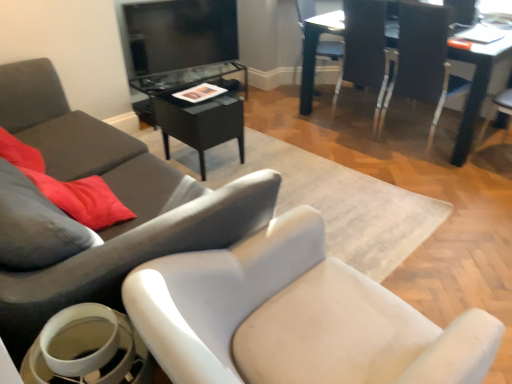
Describe the element at coordinates (84, 348) in the screenshot. I see `white glossy cup at lower left` at that location.

The height and width of the screenshot is (384, 512). Find the location of `matte gray chair at center, the 5th chair positioned from the right`. matte gray chair at center, the 5th chair positioned from the right is located at coordinates (106, 228).

What do you see at coordinates (295, 317) in the screenshot? I see `light gray fabric chair at lower left, the 2th chair positioned from the left` at bounding box center [295, 317].

Where is `matte black tv stand at upper center`? The height and width of the screenshot is (384, 512). matte black tv stand at upper center is located at coordinates (178, 46).

I want to click on wooden table at upper right, positioned as the first table in right-to-left order, so click(x=476, y=87).

Which object is closer to the camera taking this photo, white plastic chair at upper right, marked as the 5th chair in a left-to-right arrangement, or white plastic chair at upper right, the 3th chair from the left?

white plastic chair at upper right, marked as the 5th chair in a left-to-right arrangement, is in front.

From a real-world perspective, is white plastic chair at upper right, marked as the 1th chair in a right-to-left arrangement, over white plastic chair at upper right, the 3th chair from the left?

Yes, from a real-world perspective, white plastic chair at upper right, marked as the 1th chair in a right-to-left arrangement, is over white plastic chair at upper right, the 3th chair from the left

Between white plastic chair at upper right, marked as the 5th chair in a left-to-right arrangement, and white plastic chair at upper right, the 3th chair from the left, which one appears on the left side from the viewer's perspective?

Positioned to the left is white plastic chair at upper right, the 3th chair from the left.

Can you confirm if white plastic chair at upper right, marked as the 1th chair in a right-to-left arrangement, is taller than white plastic chair at upper right, the 3th chair when ordered from right to left?

Yes, white plastic chair at upper right, marked as the 1th chair in a right-to-left arrangement, is taller than white plastic chair at upper right, the 3th chair when ordered from right to left.

Locate an element on the screen. The image size is (512, 384). entertainment center that appears on the left of white glossy chair at upper right, marked as the 2th chair in a right-to-left arrangement is located at coordinates (178, 46).

Which object is thinner, matte black tv stand at upper center or white glossy chair at upper right, marked as the 2th chair in a right-to-left arrangement?

matte black tv stand at upper center.

Does matte black tv stand at upper center lie in front of white glossy chair at upper right, the fourth chair viewed from the left?

No, it is behind white glossy chair at upper right, the fourth chair viewed from the left.

Is white plastic chair at upper right, the 3th chair from the left, facing away from white glossy cup at lower left?

No.

Consider the image. Is white plastic chair at upper right, the 3th chair when ordered from right to left, wider than white glossy cup at lower left?

Yes.

From the image's perspective, is white plastic chair at upper right, the 3th chair when ordered from right to left, beneath white glossy cup at lower left?

No, from the image's perspective, white plastic chair at upper right, the 3th chair when ordered from right to left, is not below white glossy cup at lower left.

Consider the image. Which object is positioned more to the left, white plastic chair at upper right, the 3th chair when ordered from right to left, or white glossy cup at lower left?

Positioned to the left is white glossy cup at lower left.

In the scene shown: What's the angular difference between white glossy cup at lower left and white plastic chair at upper right, the 3th chair when ordered from right to left,'s facing directions?

There is a 77.1-degree angle between the facing directions of white glossy cup at lower left and white plastic chair at upper right, the 3th chair when ordered from right to left.

From a real-world perspective, count 1st chairs downward from the white glossy cup at lower left and point to it. Please provide its 2D coordinates.

[(331, 50)]

Does white glossy cup at lower left lie in front of white plastic chair at upper right, the 3th chair from the left?

Yes, white glossy cup at lower left is in front of white plastic chair at upper right, the 3th chair from the left.

From the image's perspective, between white glossy cup at lower left and white plastic chair at upper right, the 3th chair from the left, who is located below?

white glossy cup at lower left appears lower in the image.

Considering the positions of objects matte black tv stand at upper center and white plastic chair at upper right, marked as the 5th chair in a left-to-right arrangement, in the image provided, who is more to the right, matte black tv stand at upper center or white plastic chair at upper right, marked as the 5th chair in a left-to-right arrangement,?

white plastic chair at upper right, marked as the 5th chair in a left-to-right arrangement, is more to the right.

Who is smaller, matte black tv stand at upper center or white plastic chair at upper right, marked as the 5th chair in a left-to-right arrangement?

Smaller between the two is matte black tv stand at upper center.

From the image's perspective, which is above, matte black tv stand at upper center or white plastic chair at upper right, marked as the 5th chair in a left-to-right arrangement?

matte black tv stand at upper center.

Is white plastic chair at upper right, marked as the 5th chair in a left-to-right arrangement, completely or partially inside matte black tv stand at upper center?

No, white plastic chair at upper right, marked as the 5th chair in a left-to-right arrangement, is not inside matte black tv stand at upper center.

Is matte gray chair at center, the first chair when ordered from left to right, completely or partially outside of white plastic chair at upper right, marked as the 5th chair in a left-to-right arrangement?

Yes.

From the image's perspective, is matte gray chair at center, the first chair when ordered from left to right, above or below white plastic chair at upper right, marked as the 1th chair in a right-to-left arrangement?

matte gray chair at center, the first chair when ordered from left to right, is situated lower than white plastic chair at upper right, marked as the 1th chair in a right-to-left arrangement, in the image.

Does matte gray chair at center, the 5th chair positioned from the right, have a lesser width compared to white plastic chair at upper right, marked as the 1th chair in a right-to-left arrangement?

No, matte gray chair at center, the 5th chair positioned from the right, is not thinner than white plastic chair at upper right, marked as the 1th chair in a right-to-left arrangement.

From a real-world perspective, between matte gray chair at center, the first chair when ordered from left to right, and white plastic chair at upper right, marked as the 5th chair in a left-to-right arrangement, who is vertically higher?

white plastic chair at upper right, marked as the 5th chair in a left-to-right arrangement, is physically above.

From a real-world perspective, is white glossy cup at lower left positioned over white plastic chair at upper right, marked as the 5th chair in a left-to-right arrangement, based on gravity?

Actually, white glossy cup at lower left is physically below white plastic chair at upper right, marked as the 5th chair in a left-to-right arrangement, in the real world.

Looking at the image, does white glossy cup at lower left seem bigger or smaller compared to white plastic chair at upper right, marked as the 1th chair in a right-to-left arrangement?

Considering their sizes, white glossy cup at lower left takes up less space than white plastic chair at upper right, marked as the 1th chair in a right-to-left arrangement.

In the image, is white glossy cup at lower left positioned in front of or behind white plastic chair at upper right, marked as the 5th chair in a left-to-right arrangement?

Visually, white glossy cup at lower left is located in front of white plastic chair at upper right, marked as the 5th chair in a left-to-right arrangement.

How different are the orientations of white glossy cup at lower left and white plastic chair at upper right, marked as the 1th chair in a right-to-left arrangement, in degrees?

1.54 degrees separate the facing orientations of white glossy cup at lower left and white plastic chair at upper right, marked as the 1th chair in a right-to-left arrangement.

Where is `the 2nd chair counting from the right of the white plastic chair at upper right, the 3th chair when ordered from right to left`? the 2nd chair counting from the right of the white plastic chair at upper right, the 3th chair when ordered from right to left is located at coordinates pyautogui.click(x=423, y=57).

Identify the location of entertainment center that appears behind the white glossy chair at upper right, the fourth chair viewed from the left. (178, 46).

Estimate the real-world distances between objects in this image. Which object is closer to matte gray chair at center, the first chair when ordered from left to right, white glossy chair at upper right, marked as the 2th chair in a right-to-left arrangement, or white glossy cup at lower left?

white glossy cup at lower left lies closer to matte gray chair at center, the first chair when ordered from left to right, than the other object.

Estimate the real-world distances between objects in this image. Which object is closer to white glossy cup at lower left, white plastic chair at upper right, marked as the 5th chair in a left-to-right arrangement, or wooden table at upper right, positioned as the first table in right-to-left order?

Among the two, white plastic chair at upper right, marked as the 5th chair in a left-to-right arrangement, is located nearer to white glossy cup at lower left.

Which object lies nearer to the anchor point wooden table at upper right, positioned as the first table in right-to-left order, matte gray chair at center, the first chair when ordered from left to right, or matte black tv stand at upper center?

The object closer to wooden table at upper right, positioned as the first table in right-to-left order, is matte black tv stand at upper center.

Considering their positions, is wooden table at upper right, positioned as the first table in right-to-left order, positioned further to white plastic chair at upper right, the 3th chair when ordered from right to left, than white glossy cup at lower left?

white glossy cup at lower left is positioned further to the anchor white plastic chair at upper right, the 3th chair when ordered from right to left.

Estimate the real-world distances between objects in this image. Which object is closer to matte gray chair at center, the 5th chair positioned from the right, white plastic chair at upper right, the 3th chair from the left, or black glass table at center, acting as the 2th table starting from the right?

Among the two, black glass table at center, acting as the 2th table starting from the right, is located nearer to matte gray chair at center, the 5th chair positioned from the right.

Looking at the image, which one is located further to light gray fabric chair at lower left, which is counted as the fourth chair, starting from the right, matte gray chair at center, the 5th chair positioned from the right, or black glass table at center, acting as the 2th table starting from the right?

Among the two, black glass table at center, acting as the 2th table starting from the right, is located further to light gray fabric chair at lower left, which is counted as the fourth chair, starting from the right.

Estimate the real-world distances between objects in this image. Which object is closer to white plastic chair at upper right, the 3th chair when ordered from right to left, matte gray chair at center, the 5th chair positioned from the right, or matte black tv stand at upper center?

matte black tv stand at upper center is closer to white plastic chair at upper right, the 3th chair when ordered from right to left.

When comparing their distances from white glossy chair at upper right, the fourth chair viewed from the left, does wooden table at upper right, marked as the 2th table in a left-to-right arrangement, or black glass table at center, acting as the 2th table starting from the right, seem closer?

wooden table at upper right, marked as the 2th table in a left-to-right arrangement.

Locate an element on the screen. chair between white plastic chair at upper right, marked as the 1th chair in a right-to-left arrangement, and white plastic chair at upper right, the 3th chair when ordered from right to left, along the z-axis is located at coordinates (366, 47).

Where is `round table between matte gray chair at center, the 5th chair positioned from the right, and white plastic chair at upper right, marked as the 1th chair in a right-to-left arrangement, in the horizontal direction`? The height and width of the screenshot is (384, 512). round table between matte gray chair at center, the 5th chair positioned from the right, and white plastic chair at upper right, marked as the 1th chair in a right-to-left arrangement, in the horizontal direction is located at coordinates (84, 348).

Locate an element on the screen. This screenshot has height=384, width=512. round table between matte gray chair at center, the 5th chair positioned from the right, and light gray fabric chair at lower left, the 2th chair positioned from the left, from left to right is located at coordinates (84, 348).

Locate an element on the screen. This screenshot has width=512, height=384. table situated between matte gray chair at center, the 5th chair positioned from the right, and wooden table at upper right, marked as the 2th table in a left-to-right arrangement, from left to right is located at coordinates (196, 107).